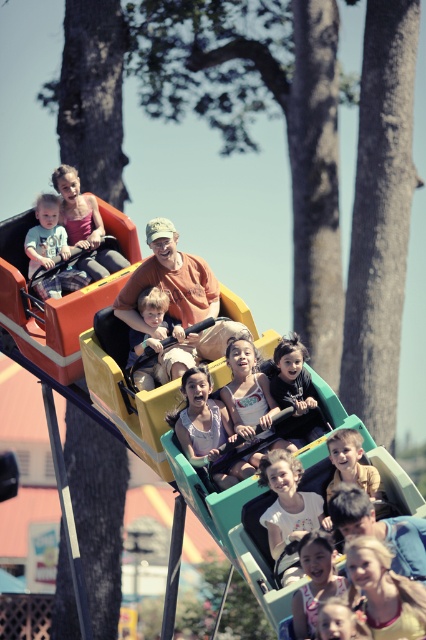
You are a parent at the theme park and see your child with light brown hair at lower center near the matte yellow slide at lower center. You want to ensure their safety. Is the child positioned in a safe spot relative to the slide?

The light brown hair at lower center is below the matte yellow slide at lower center, which means the child is at the bottom of the slide. This is a safe position as they are not on the slide itself.

You are a parent pushing a light brown fabric baby carriage at center and wearing a matte blue shirt at center. Can you tell me which item is narrower between the two?

The light brown fabric baby carriage at center is thinner than the matte blue shirt at center, so the light brown fabric baby carriage at center is narrower.